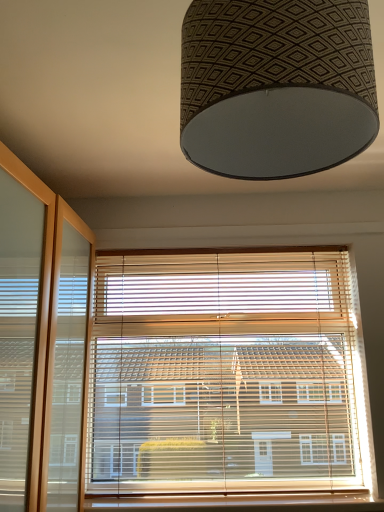
Measure the distance between point (228, 61) and camera.

56.20 centimeters.

Where is `wooden blinds at center`? This screenshot has height=512, width=384. wooden blinds at center is located at coordinates (226, 374).

Considering the relative sizes of wooden blinds at center and wooden at lower center in the image provided, is wooden blinds at center bigger than wooden at lower center?

Yes.

Does wooden blinds at center turn towards wooden at lower center?

Yes, wooden blinds at center is turned towards wooden at lower center.

From a real-world perspective, is wooden blinds at center physically below wooden at lower center?

No, from a real-world perspective, wooden blinds at center is not beneath wooden at lower center.

Is the position of wooden blinds at center more distant than that of wooden at lower center?

Yes, wooden blinds at center is behind wooden at lower center.

Can you confirm if wooden at lower center is taller than patterned fabric lampshade at upper center?

No, wooden at lower center is not taller than patterned fabric lampshade at upper center.

Between wooden at lower center and patterned fabric lampshade at upper center, which one appears on the right side from the viewer's perspective?

From the viewer's perspective, wooden at lower center appears more on the right side.

From a real-world perspective, is wooden at lower center located higher than patterned fabric lampshade at upper center?

Incorrect, from a real-world perspective, wooden at lower center is lower than patterned fabric lampshade at upper center.

Would you say patterned fabric lampshade at upper center is part of wooden at lower center's contents?

No.

Is patterned fabric lampshade at upper center behind wooden at lower center?

No, patterned fabric lampshade at upper center is in front of wooden at lower center.

From a real-world perspective, which is physically above, patterned fabric lampshade at upper center or wooden at lower center?

patterned fabric lampshade at upper center is physically above.

Which object is wider, patterned fabric lampshade at upper center or wooden at lower center?

With larger width is patterned fabric lampshade at upper center.

Does point (263, 497) come farther from viewer compared to point (321, 386)?

No, (263, 497) is in front of (321, 386).

Between wooden at lower center and wooden blinds at center, which one has smaller width?

With smaller width is wooden blinds at center.

Is wooden at lower center far away from wooden blinds at center?

No, there isn't a large distance between wooden at lower center and wooden blinds at center.

How much distance is there between wooden at lower center and wooden blinds at center?

The distance of wooden at lower center from wooden blinds at center is 17.20 inches.

From the image's perspective, which object appears higher, wooden blinds at center or patterned fabric lampshade at upper center?

patterned fabric lampshade at upper center.

Find the location of a particular element. This screenshot has width=384, height=512. window blind that appears below the patterned fabric lampshade at upper center (from the image's perspective) is located at coordinates (226, 374).

Does wooden blinds at center turn towards patterned fabric lampshade at upper center?

Yes.

Between patterned fabric lampshade at upper center and wooden blinds at center, which one appears on the right side from the viewer's perspective?

From the viewer's perspective, patterned fabric lampshade at upper center appears more on the right side.

Which object is more forward, patterned fabric lampshade at upper center or wooden blinds at center?

patterned fabric lampshade at upper center is in front.

Is patterned fabric lampshade at upper center taller or shorter than wooden blinds at center?

patterned fabric lampshade at upper center is shorter than wooden blinds at center.

Choose the correct answer: Is patterned fabric lampshade at upper center inside wooden blinds at center or outside it?

patterned fabric lampshade at upper center is located beyond the bounds of wooden blinds at center.

Identify the location of window blind on the left of the wooden at lower center. (226, 374).

This screenshot has height=512, width=384. I want to click on window sill behind the patterned fabric lampshade at upper center, so click(238, 502).

From the picture: Considering their positions, is wooden blinds at center positioned further to wooden at lower center than patterned fabric lampshade at upper center?

patterned fabric lampshade at upper center.

Estimate the real-world distances between objects in this image. Which object is closer to wooden at lower center, patterned fabric lampshade at upper center or wooden blinds at center?

Based on the image, wooden blinds at center appears to be nearer to wooden at lower center.

Which object lies nearer to the anchor point wooden blinds at center, patterned fabric lampshade at upper center or wooden at lower center?

Based on the image, wooden at lower center appears to be nearer to wooden blinds at center.

Considering their positions, is wooden at lower center positioned closer to patterned fabric lampshade at upper center than wooden blinds at center?

wooden blinds at center is positioned closer to the anchor patterned fabric lampshade at upper center.

Which object lies further to the anchor point patterned fabric lampshade at upper center, wooden blinds at center or wooden at lower center?

wooden at lower center is positioned further to the anchor patterned fabric lampshade at upper center.

Considering their positions, is wooden at lower center positioned closer to wooden blinds at center than patterned fabric lampshade at upper center?

Among the two, wooden at lower center is located nearer to wooden blinds at center.

Where is `window blind between patterned fabric lampshade at upper center and wooden at lower center in the up-down direction`? The width and height of the screenshot is (384, 512). window blind between patterned fabric lampshade at upper center and wooden at lower center in the up-down direction is located at coordinates (226, 374).